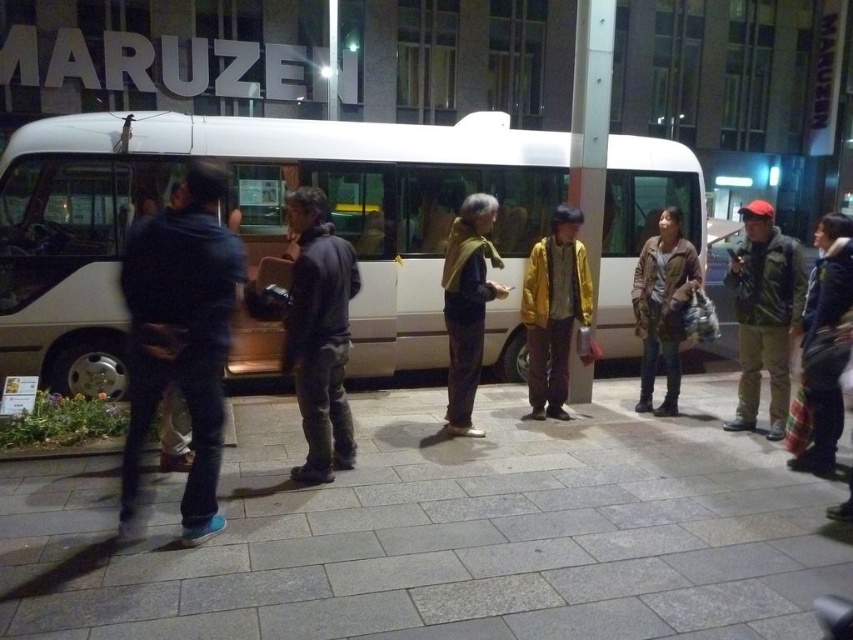
Who is more forward, (753, 202) or (560, 413)?

Point (560, 413)

Is camouflage jacket at right smaller than yellow matte jacket at center?

Yes, camouflage jacket at right is smaller than yellow matte jacket at center.

Is point (746, 211) closer to viewer compared to point (552, 216)?

Yes, it is.

At what (x,y) coordinates should I click in order to perform the action: click on camouflage jacket at right. Please return your answer as a coordinate pair (x, y). This screenshot has width=853, height=640. Looking at the image, I should click on pyautogui.click(x=764, y=314).

Does point (726, 573) come behind point (457, 244)?

No, it is in front of (457, 244).

Who is more distant from viewer, (39,577) or (473,204)?

The point (473,204) is more distant.

This screenshot has height=640, width=853. What do you see at coordinates (444, 532) in the screenshot? I see `gray concrete pavement at center` at bounding box center [444, 532].

Identify the location of gray concrete pavement at center. This screenshot has width=853, height=640. 444,532.

Is the position of dark gray fabric jacket at center more distant than that of yellow scarf at center?

No, it is in front of yellow scarf at center.

Is dark gray fabric jacket at center to the left of yellow scarf at center from the viewer's perspective?

Correct, you'll find dark gray fabric jacket at center to the left of yellow scarf at center.

Identify the location of dark gray fabric jacket at center. (318, 336).

The image size is (853, 640). Identify the location of dark gray fabric jacket at center. (318, 336).